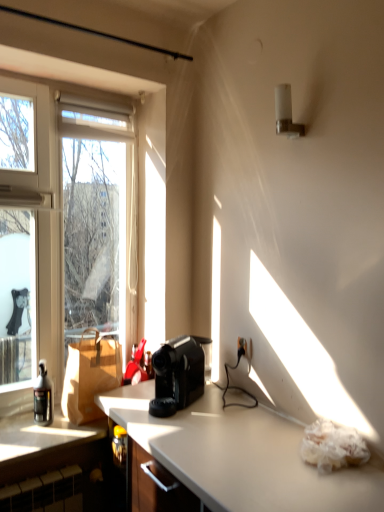
At what (x,y) coordinates should I click in order to perform the action: click on vacant area that is situated to the right of translucent glass bottle at left. Please return your answer as a coordinate pair (x, y). The width and height of the screenshot is (384, 512). Looking at the image, I should click on (74, 425).